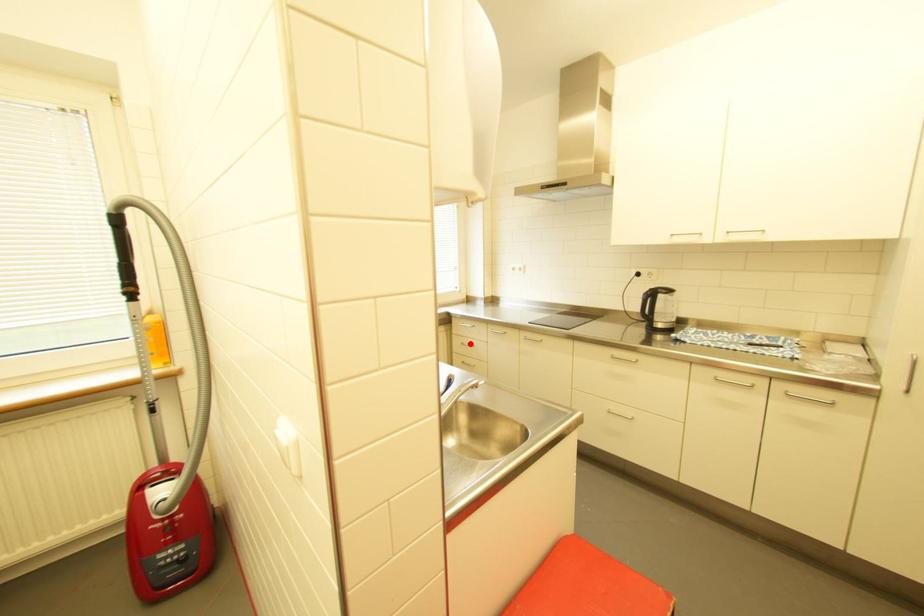
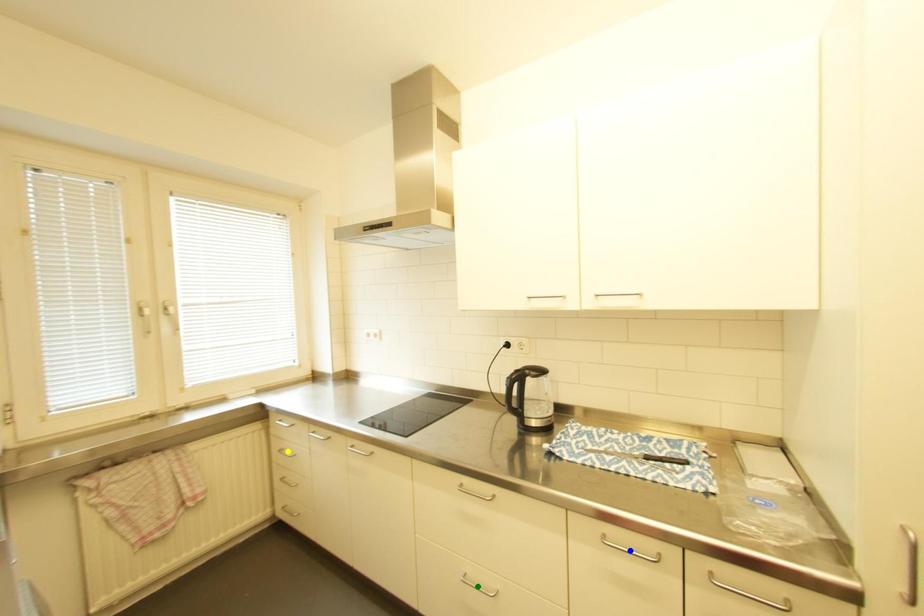
Question: I am providing you with two images of the same scene from different viewpoints. A red point is marked on the first image. You are given multiple points on the second image. Which spot in image 2 lines up with the point in image 1?

Choices:
 (A) yellow point
 (B) green point
 (C) blue point

Answer: (A)